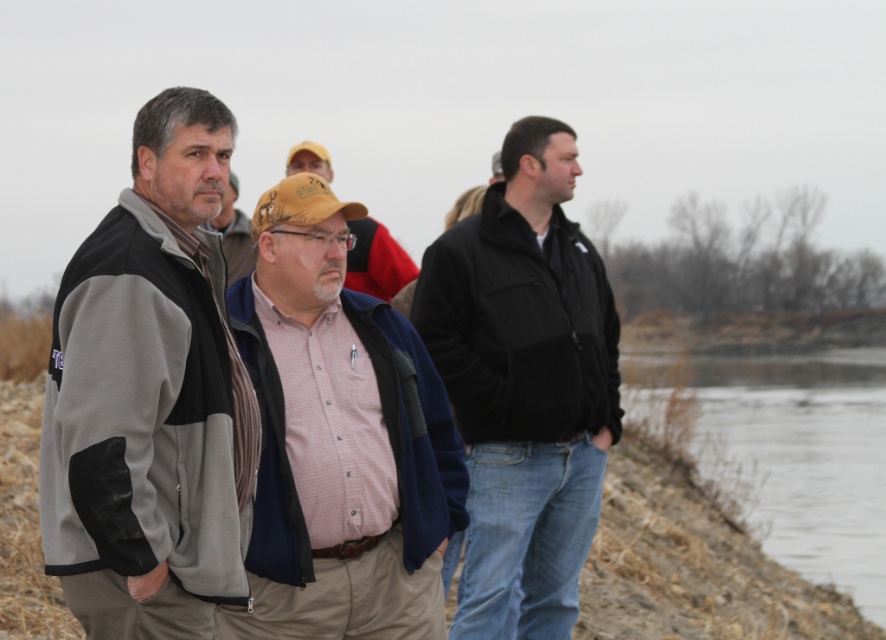
Does black fleece jacket at center have a lesser height compared to brown dirt at lower right?

In fact, black fleece jacket at center may be taller than brown dirt at lower right.

Between black fleece jacket at center and brown dirt at lower right, which one appears on the left side from the viewer's perspective?

black fleece jacket at center

The width and height of the screenshot is (886, 640). Identify the location of black fleece jacket at center. (525, 381).

I want to click on black fleece jacket at center, so click(x=525, y=381).

What do you see at coordinates (150, 396) in the screenshot? Image resolution: width=886 pixels, height=640 pixels. I see `gray fleece jacket at left` at bounding box center [150, 396].

I want to click on gray fleece jacket at left, so click(150, 396).

Locate an element on the screen. The height and width of the screenshot is (640, 886). gray fleece jacket at left is located at coordinates (150, 396).

Between pink checkered shirt at center and brown dirt at lower right, which one has less height?

With less height is pink checkered shirt at center.

Which is in front, point (364, 545) or point (803, 544)?

Point (364, 545) is more forward.

You are a GUI agent. You are given a task and a screenshot of the screen. Output one action in this format:
    pyautogui.click(x=<x>, y=<y>)
    Task: Click on the pink checkered shirt at center
    
    Given the screenshot: What is the action you would take?
    pyautogui.click(x=339, y=440)